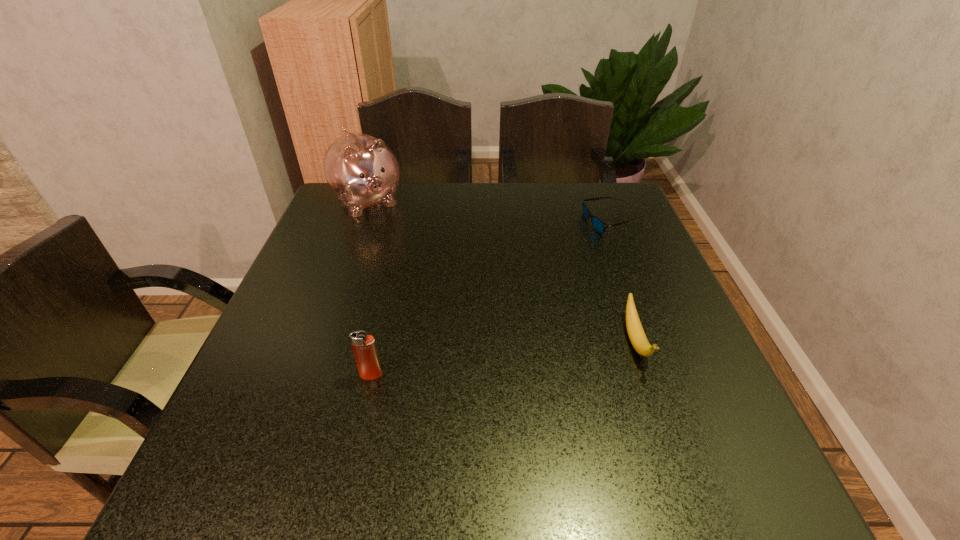
Identify the location of free space between the tallest object and the igniter. (370, 288).

Where is `empty space between the tallest object and the third shortest object`? empty space between the tallest object and the third shortest object is located at coordinates (370, 288).

The height and width of the screenshot is (540, 960). I want to click on vacant point located between the second tallest object and the piggy bank, so click(370, 288).

I want to click on vacant area that lies between the shortest object and the banana, so click(624, 282).

At what (x,y) coordinates should I click in order to perform the action: click on blank region between the sunglasses and the tallest object. Please return your answer as a coordinate pair (x, y). Looking at the image, I should click on (490, 212).

I want to click on object that stands as the second closest to the shortest object, so click(x=361, y=170).

Where is `the third closest object to the shortest object`? The width and height of the screenshot is (960, 540). the third closest object to the shortest object is located at coordinates [364, 348].

Locate an element on the screen. vacant space that satisfies the following two spatial constraints: 1. on the front side of the piggy bank; 2. on the left side of the third shortest object is located at coordinates (304, 375).

Where is `free location that satisfies the following two spatial constraints: 1. on the front side of the igniter; 2. on the left side of the piggy bank`? The height and width of the screenshot is (540, 960). free location that satisfies the following two spatial constraints: 1. on the front side of the igniter; 2. on the left side of the piggy bank is located at coordinates (304, 375).